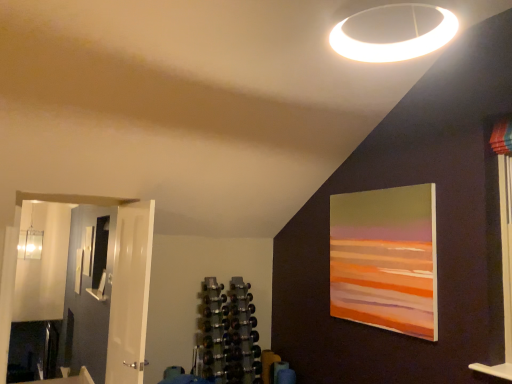
Question: From a real-world perspective, is white glossy door at left located beneath matte acrylic painting at upper right, which is the first picture frame from front to back?

Choices:
 (A) yes
 (B) no

Answer: (A)

Question: Does white glossy door at left appear on the left side of matte acrylic painting at upper right, marked as the second picture frame in a left-to-right arrangement?

Choices:
 (A) yes
 (B) no

Answer: (A)

Question: Can you confirm if white glossy door at left is smaller than matte acrylic painting at upper right, the 1th picture frame viewed from the top?

Choices:
 (A) no
 (B) yes

Answer: (A)

Question: Is white glossy door at left in contact with matte acrylic painting at upper right, acting as the 1th picture frame starting from the right?

Choices:
 (A) yes
 (B) no

Answer: (B)

Question: Can you confirm if white glossy door at left is thinner than matte acrylic painting at upper right, placed as the second picture frame when sorted from back to front?

Choices:
 (A) yes
 (B) no

Answer: (B)

Question: Does white glossy door at left appear on the right side of matte acrylic painting at upper right, marked as the second picture frame in a left-to-right arrangement?

Choices:
 (A) yes
 (B) no

Answer: (B)

Question: Can you confirm if matte acrylic painting at upper right, acting as the 1th picture frame starting from the right, is taller than metallic dumbbell rack at center?

Choices:
 (A) no
 (B) yes

Answer: (A)

Question: Can you confirm if matte acrylic painting at upper right, placed as the second picture frame when sorted from back to front, is smaller than metallic dumbbell rack at center?

Choices:
 (A) no
 (B) yes

Answer: (B)

Question: From the image's perspective, is matte acrylic painting at upper right, the 1th picture frame viewed from the top, under metallic dumbbell rack at center?

Choices:
 (A) no
 (B) yes

Answer: (A)

Question: From the image's perspective, does matte acrylic painting at upper right, the 1th picture frame viewed from the top, appear higher than metallic dumbbell rack at center?

Choices:
 (A) yes
 (B) no

Answer: (A)

Question: Is matte acrylic painting at upper right, acting as the 1th picture frame starting from the right, aimed at metallic dumbbell rack at center?

Choices:
 (A) no
 (B) yes

Answer: (A)

Question: Is matte acrylic painting at upper right, the 1th picture frame viewed from the top, oriented away from metallic dumbbell rack at center?

Choices:
 (A) yes
 (B) no

Answer: (B)

Question: Is metallic dumbbell rack at center facing away from white glossy door at left?

Choices:
 (A) yes
 (B) no

Answer: (B)